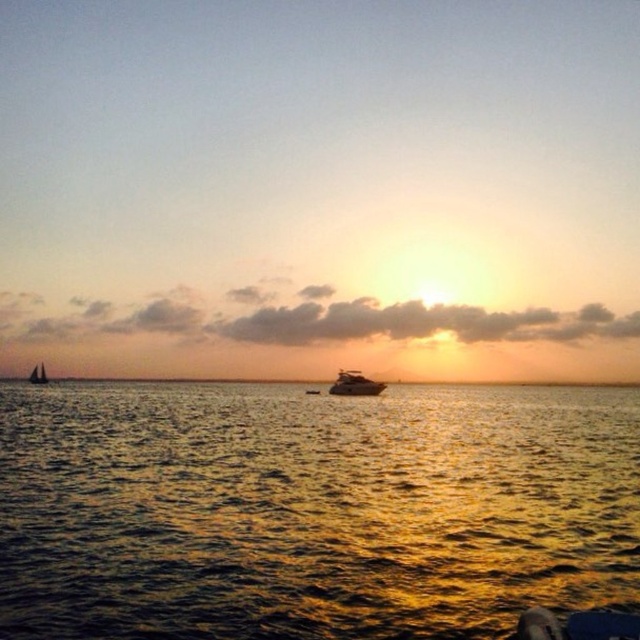
Between shiny golden water at center and white sailboat at left, which one has less height?

shiny golden water at center

Between shiny golden water at center and white sailboat at left, which one is positioned higher?

shiny golden water at center is higher up.

Where is `shiny golden water at center`? The width and height of the screenshot is (640, 640). shiny golden water at center is located at coordinates (310, 509).

Does shiny silver yacht at center have a larger size compared to white sailboat at left?

No, shiny silver yacht at center is not bigger than white sailboat at left.

Between point (330, 388) and point (42, 364), which one is positioned behind?

Positioned behind is point (42, 364).

Does point (356, 376) come farther from viewer compared to point (29, 381)?

No, it is not.

Identify the location of shiny silver yacht at center. The image size is (640, 640). pyautogui.click(x=355, y=385).

Does shiny golden water at center have a greater height compared to shiny silver yacht at center?

Yes.

Consider the image. Can you confirm if shiny golden water at center is positioned below shiny silver yacht at center?

Correct, shiny golden water at center is located below shiny silver yacht at center.

Between point (456, 484) and point (348, 374), which one is positioned in front?

Positioned in front is point (456, 484).

I want to click on shiny golden water at center, so click(x=310, y=509).